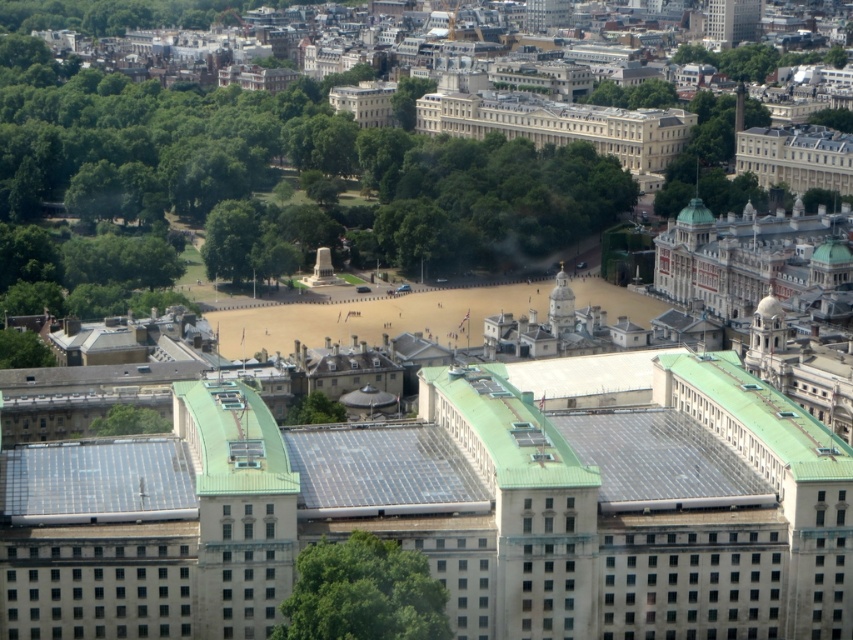
Is transparent solar panels at center bigger than green metallic roof at center-right?

No.

Is point (453, 499) closer to camera compared to point (741, 381)?

Yes, point (453, 499) is closer to viewer.

Does point (426, 458) come in front of point (747, 406)?

Yes, it is.

Locate an element on the screen. transparent solar panels at center is located at coordinates (381, 470).